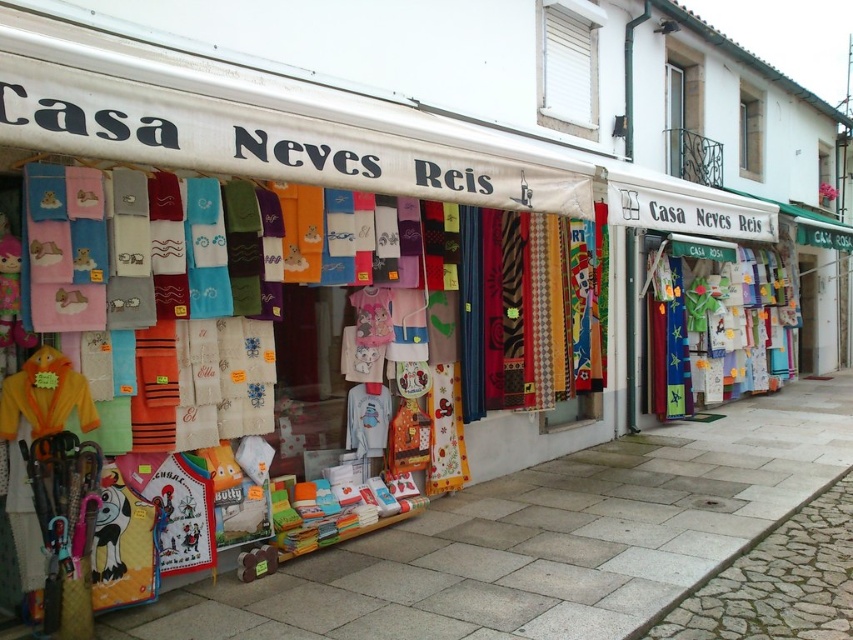
You are a delivery person approaching the storefront and need to place a package on the smooth stone pavement at lower center. However, there is a transparent glass window at upper center in the way. Can you move the package from your current position to the desired location without hitting the window?

The smooth stone pavement at lower center is to the left of the transparent glass window at upper center, so you can move the package around the left side of the window to reach the pavement safely without hitting the window.

Consider the image. You are a delivery person carrying a large box that is 1.2 meters wide. You need to walk from the cobblestone area to the storefront entrance. The path goes between the smooth stone pavement at lower center and the transparent glass window at upper center. Will your box fit through this path?

The smooth stone pavement at lower center has a lesser width compared to the transparent glass window at upper center. Since the pavement is narrower, the path between them is only as wide as the pavement. The box is 1.2 meters wide, but the path is narrower than that, so the box will not fit through the path between the smooth stone pavement at lower center and the transparent glass window at upper center.